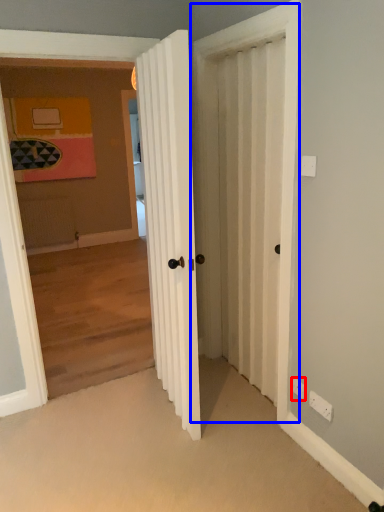
Question: Which point is further to the camera, electric outlet (highlighted by a red box) or screen door (highlighted by a blue box)?

Choices:
 (A) electric outlet
 (B) screen door

Answer: (A)